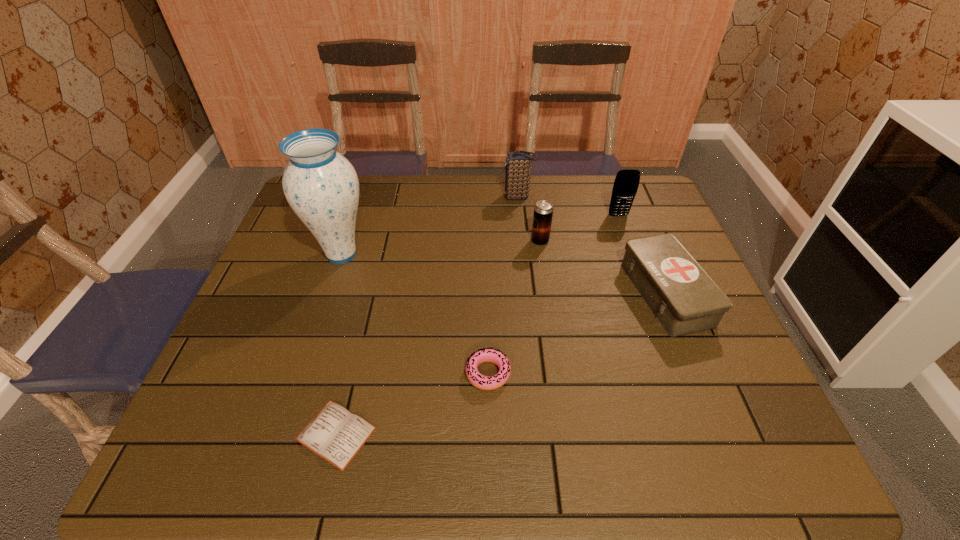
At what (x,y) coordinates should I click in order to perform the action: click on object that is the closest to the shortest object. Please return your answer as a coordinate pair (x, y). The image size is (960, 540). Looking at the image, I should click on (482, 382).

You are a GUI agent. You are given a task and a screenshot of the screen. Output one action in this format:
    pyautogui.click(x=<x>, y=<y>)
    Task: Click on the free region that satisfies the following two spatial constraints: 1. on the back side of the first-aid kit; 2. on the left side of the nearest object
    The height and width of the screenshot is (540, 960).
    Given the screenshot: What is the action you would take?
    pyautogui.click(x=370, y=294)

The image size is (960, 540). Find the location of `vacant space that satisfies the following two spatial constraints: 1. on the front side of the vase; 2. on the right side of the third shortest object`. vacant space that satisfies the following two spatial constraints: 1. on the front side of the vase; 2. on the right side of the third shortest object is located at coordinates (328, 294).

At what (x,y) coordinates should I click in order to perform the action: click on vacant space that satisfies the following two spatial constraints: 1. with the zip open on the beer can; 2. on the right side of the farthest object. Please return your answer as a coordinate pair (x, y). Looking at the image, I should click on (522, 241).

Identify the location of free region that satisfies the following two spatial constraints: 1. with the zip open on the third shortest object; 2. on the left side of the clutch bag. (528, 294).

I want to click on free spot that satisfies the following two spatial constraints: 1. on the back side of the diary; 2. on the right side of the first-aid kit, so click(x=370, y=294).